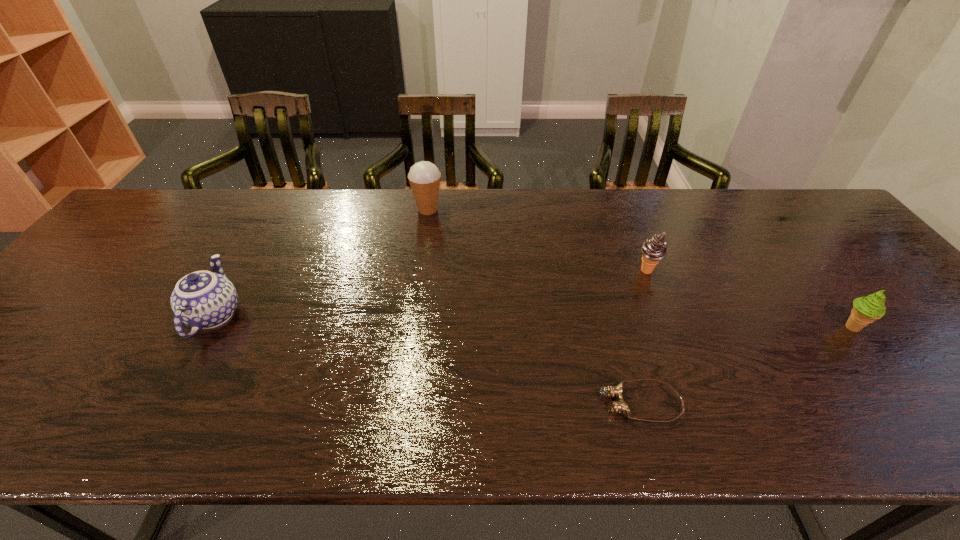
Image resolution: width=960 pixels, height=540 pixels. I want to click on free space at the far edge, so click(x=525, y=212).

Locate an element on the screen. free space at the near edge of the desktop is located at coordinates (265, 402).

Locate an element on the screen. This screenshot has width=960, height=540. vacant space at the left edge is located at coordinates (132, 249).

I want to click on vacant space at the right edge of the desktop, so click(x=913, y=323).

At what (x,y) coordinates should I click in order to perform the action: click on free space at the far right corner of the desktop. Please return your answer as a coordinate pair (x, y). This screenshot has width=960, height=540. Looking at the image, I should click on (770, 205).

The width and height of the screenshot is (960, 540). What are the coordinates of `vacant area that lies between the tallest icecream and the leftmost object` in the screenshot? It's located at (321, 262).

You are a GUI agent. You are given a task and a screenshot of the screen. Output one action in this format:
    pyautogui.click(x=<x>, y=<y>)
    Task: Click on the free space between the goggles and the second object from left to right
    
    Given the screenshot: What is the action you would take?
    pyautogui.click(x=534, y=307)

I want to click on free spot between the nearest icecream and the leftmost icecream, so [639, 268].

Where is `free area in between the nearest object and the second object from right to left`? The image size is (960, 540). free area in between the nearest object and the second object from right to left is located at coordinates (643, 338).

Locate an element on the screen. vacant area that lies between the farthest icecream and the second farthest icecream is located at coordinates click(538, 240).